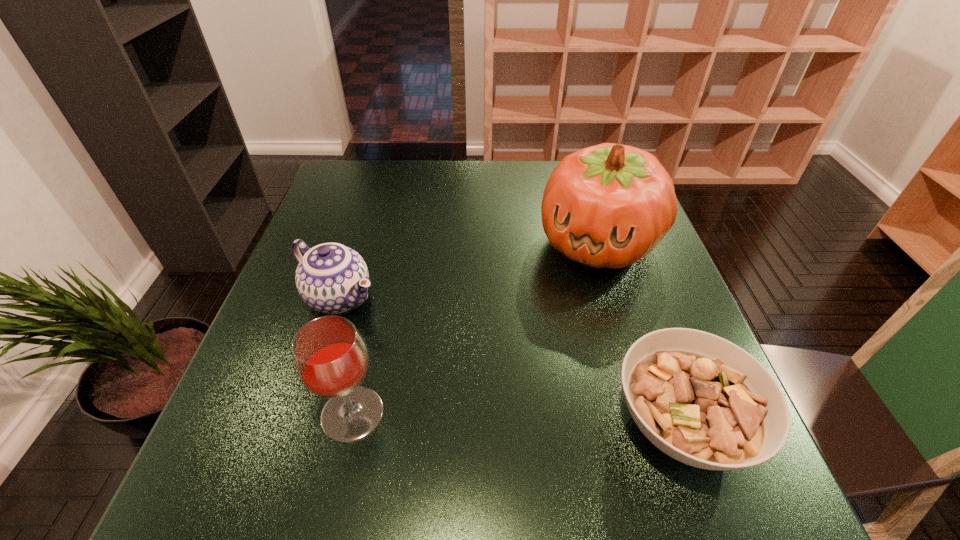
The width and height of the screenshot is (960, 540). What are the coordinates of `vacant space located 0.340m on the side of the pumpkin with the cute face` in the screenshot? It's located at (516, 393).

Locate an element on the screen. The height and width of the screenshot is (540, 960). free space located 0.230m on the side of the pumpkin with the cute face is located at coordinates (540, 351).

Where is `wineglass located at the near edge`? The image size is (960, 540). wineglass located at the near edge is located at coordinates (330, 358).

Find the location of a particular element. stew that is positioned at the near edge is located at coordinates (702, 400).

The width and height of the screenshot is (960, 540). Identify the location of object that is at the left edge. (331, 278).

Locate an element on the screen. stew at the right edge is located at coordinates (702, 400).

Where is `pumpkin at the right edge`? This screenshot has height=540, width=960. pumpkin at the right edge is located at coordinates (609, 205).

Identify the location of object situated at the near right corner. This screenshot has height=540, width=960. (702, 400).

In the image, there is a desktop. Identify the location of free space at the far edge. (402, 179).

You are a GUI agent. You are given a task and a screenshot of the screen. Output one action in this format:
    pyautogui.click(x=<x>, y=<y>)
    Task: Click on the vacant space at the left edge of the desktop
    The height and width of the screenshot is (540, 960).
    Given the screenshot: What is the action you would take?
    pyautogui.click(x=350, y=233)